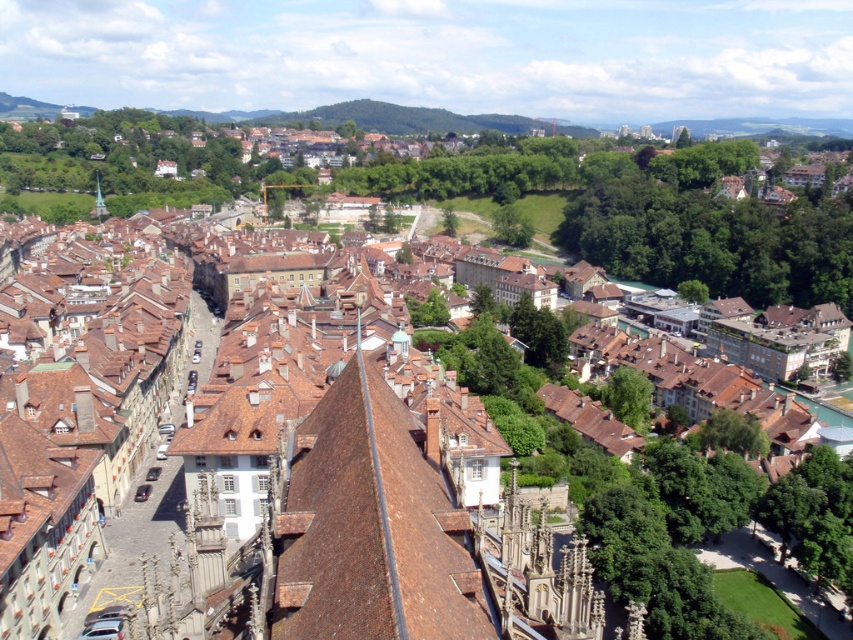
Based on the scene described, which object corresponds to the coordinates point (373,525)?

The brown tile roof at center corresponds to the coordinates point (373,525).

Based on the photo, you are standing on a hill overlooking the historic city. You notice the brown tile roof at center and the green wooden tower at center. Which of these two structures is positioned higher in the scene?

The green wooden tower at center is positioned higher than the brown tile roof at center because the brown tile roof at center is located below it.